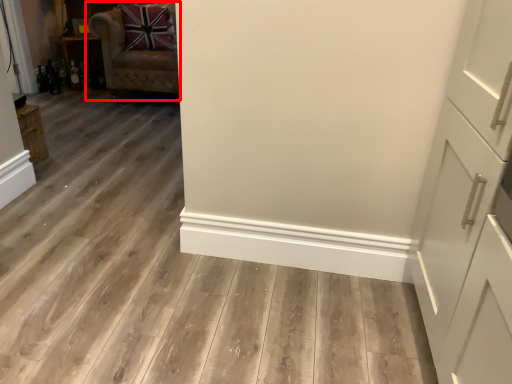
Question: From the image, what is the correct spatial relationship of chair (annotated by the red box) in relation to cabinetry?

Choices:
 (A) right
 (B) left

Answer: (A)